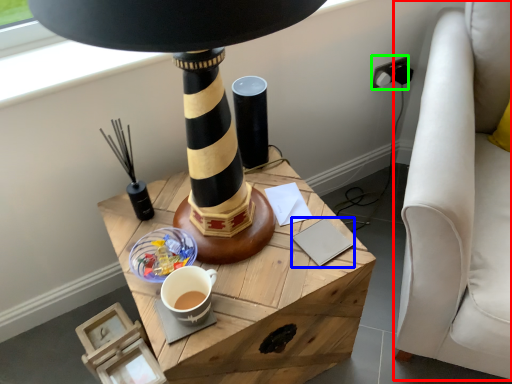
Question: Estimate the real-world distances between objects in this image. Which object is farther from swivel chair (highlighted by a red box), notepad (highlighted by a blue box) or plug (highlighted by a green box)?

Choices:
 (A) notepad
 (B) plug

Answer: (B)